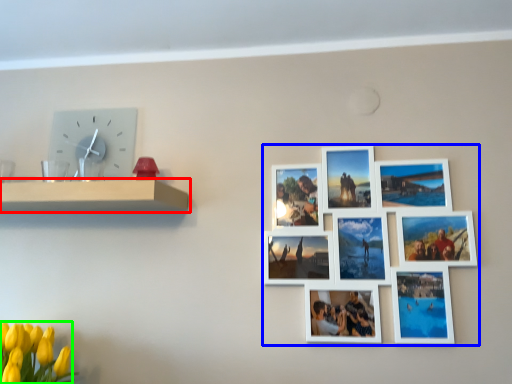
Question: Considering the real-world distances, which object is farthest from shelf (highlighted by a red box)? picture frame (highlighted by a blue box) or flower (highlighted by a green box)?

Choices:
 (A) picture frame
 (B) flower

Answer: (A)